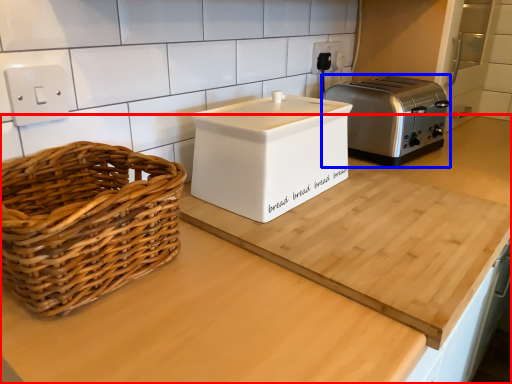
Question: Which object appears closest to the camera in this image, countertop (highlighted by a red box) or toaster (highlighted by a blue box)?

Choices:
 (A) countertop
 (B) toaster

Answer: (A)